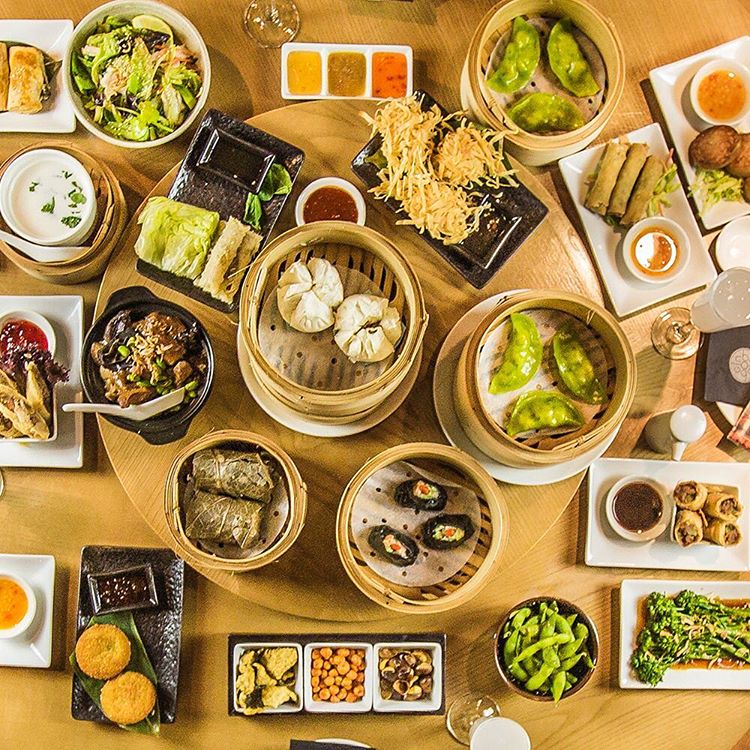
Image resolution: width=750 pixels, height=750 pixels. Find the location of `bamboo containers`. bamboo containers is located at coordinates pos(350,392), pos(354,580), pos(525,451), pos(544,141), pos(226,562), pos(87,260).